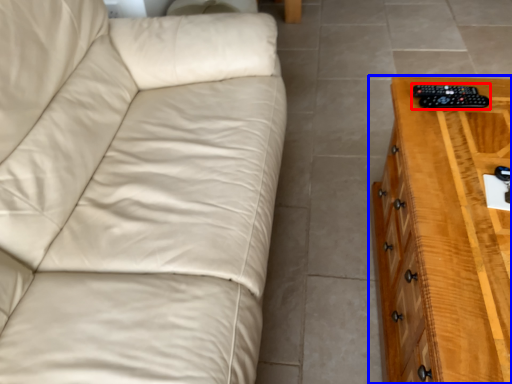
Question: Which point is closer to the camera, control (highlighted by a red box) or chest of drawers (highlighted by a blue box)?

Choices:
 (A) control
 (B) chest of drawers

Answer: (B)